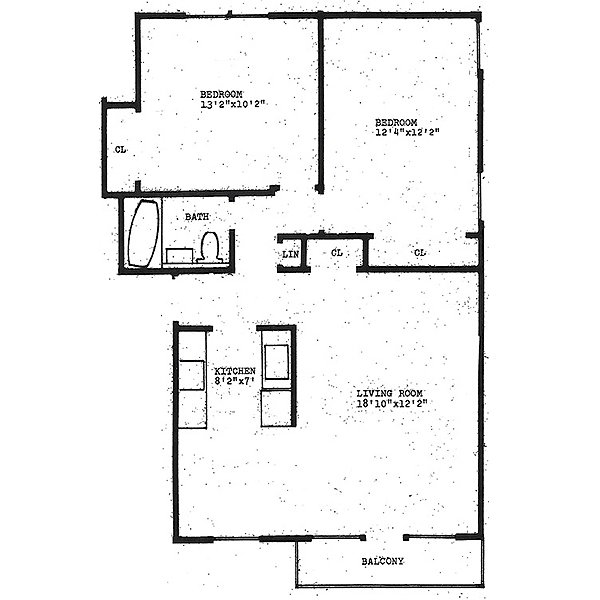
Locate an element on the screen. bedroom is located at coordinates (223, 100), (392, 121).